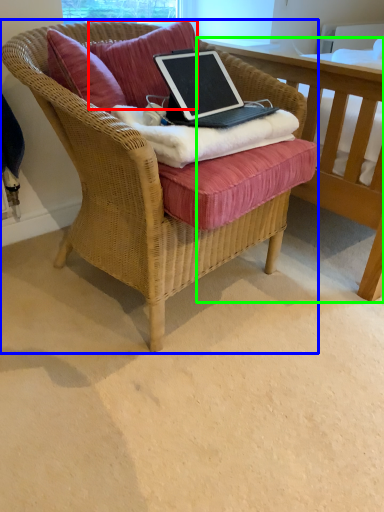
Question: Estimate the real-world distances between objects in this image. Which object is farther from pillow (highlighted by a red box), chair (highlighted by a blue box) or table (highlighted by a green box)?

Choices:
 (A) chair
 (B) table

Answer: (B)